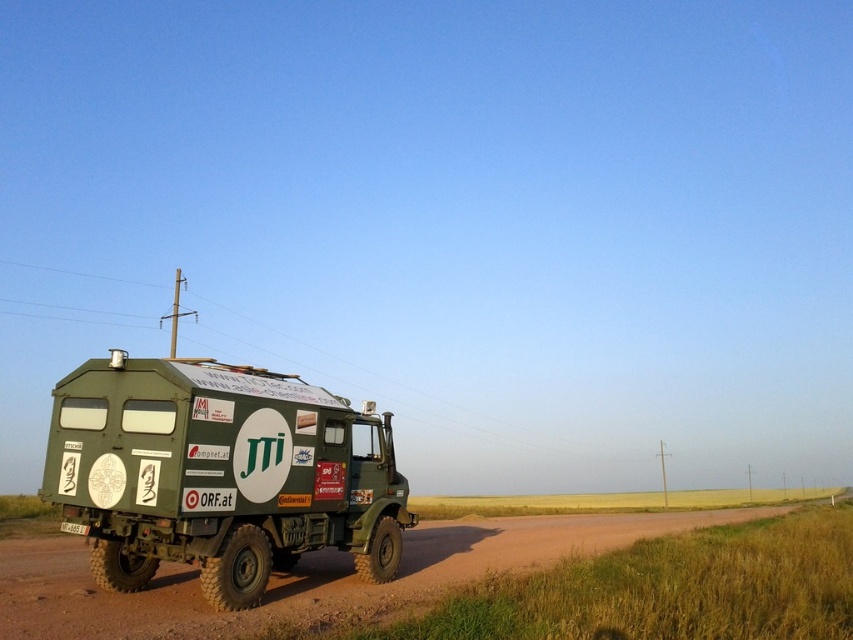
You are a delivery driver who needs to attach a GPS tracker to the green matte truck at left. The GPS tracker must be placed exactly 5 feet away from the white plastic license plate at lower left. Can you attach it to the truck itself?

The distance between the green matte truck at left and the white plastic license plate at lower left is 4.93 feet. Since the required distance is 5 feet, the GPS tracker cannot be placed on the truck itself as it is slightly closer than needed.

You are a photographer trying to capture the green matte truck at left and the white plastic license plate at lower left in the same frame. Given their sizes, which object will appear bigger in your photo?

The green matte truck at left will appear bigger in the photo since it has a larger size compared to the white plastic license plate at lower left.

You are standing in front of the truck and notice two points on its side. The first point is at coordinate (321, 529) and the second is at (71, 522). Which point is closer to you?

Point (321, 529) is further to the viewer than point (71, 522), so the second point at (71, 522) is closer to you.